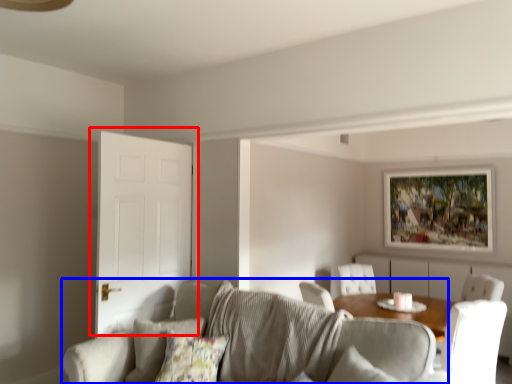
Question: Among these objects, which one is nearest to the camera, door (highlighted by a red box) or studio couch (highlighted by a blue box)?

Choices:
 (A) door
 (B) studio couch

Answer: (B)